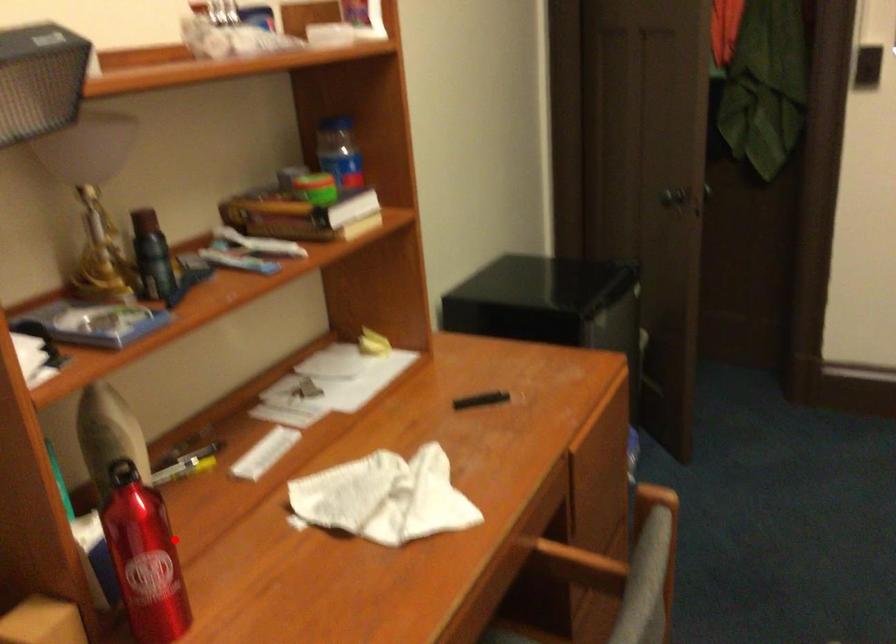
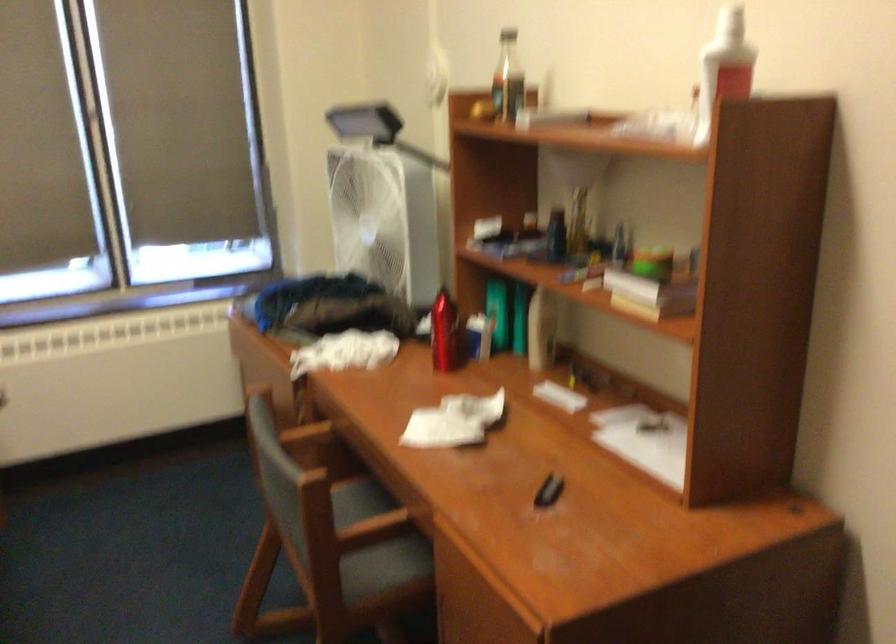
Question: I am providing you with two images of the same scene from different viewpoints. Given a red point in image1, look at the same physical point in image2. Is it:

Choices:
 (A) Closer to the viewpoint
 (B) Farther from the viewpoint

Answer: (B)